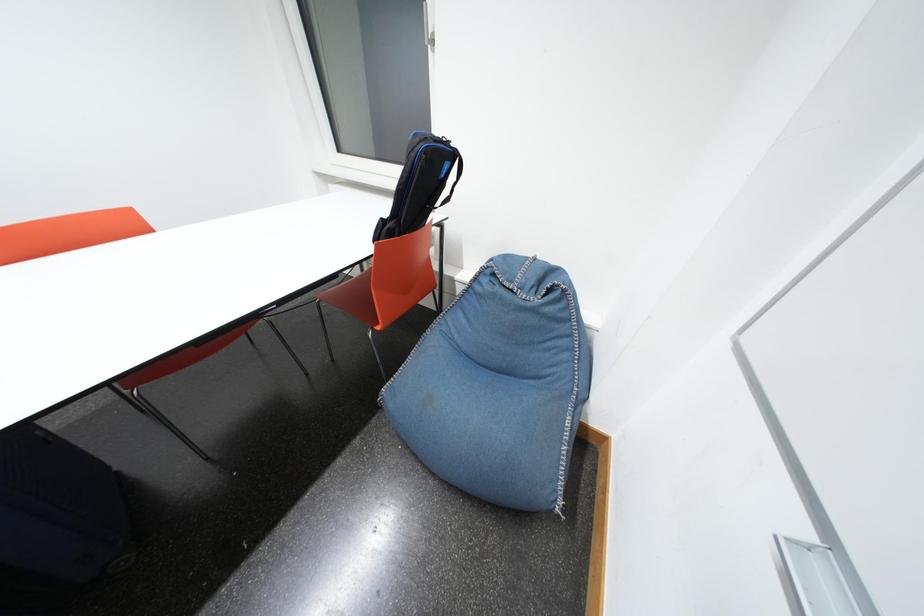
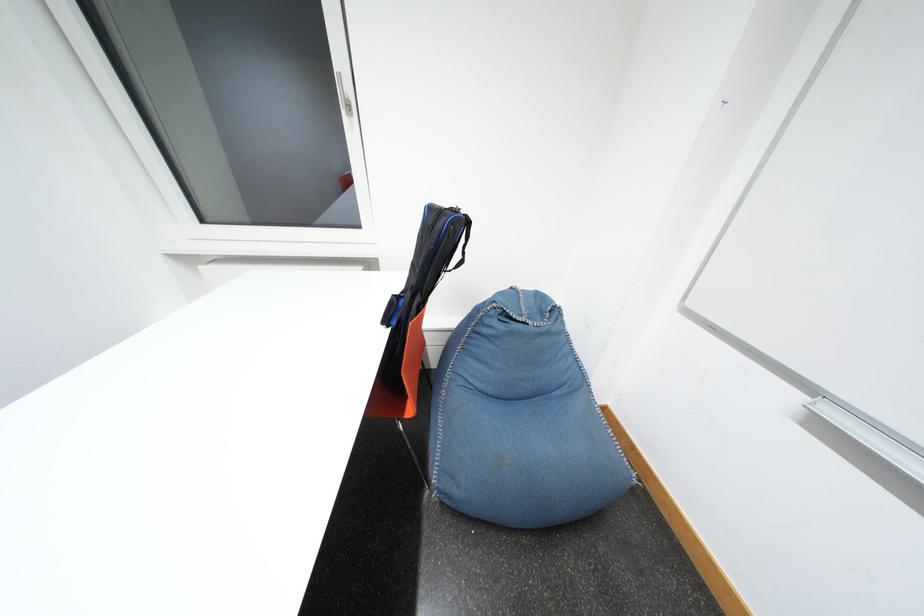
Question: Based on the continuous images, in which direction is the camera rotating? Reply with the corresponding letter.

Choices:
 (A) Left
 (B) Right
 (C) Up
 (D) Down

Answer: (B)